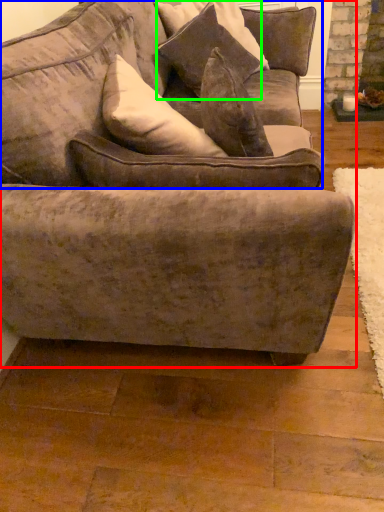
Question: Which is farther away from studio couch (highlighted by a red box)? couch (highlighted by a blue box) or pillow (highlighted by a green box)?

Choices:
 (A) couch
 (B) pillow

Answer: (B)